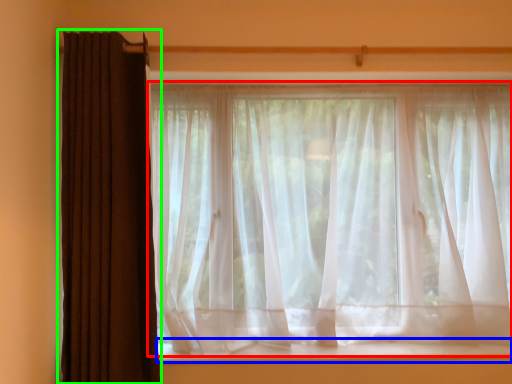
Question: Based on their relative distances, which object is farther from curtain (highlighted by a red box)? Choose from window sill (highlighted by a blue box) and curtain (highlighted by a green box).

Choices:
 (A) window sill
 (B) curtain

Answer: (B)